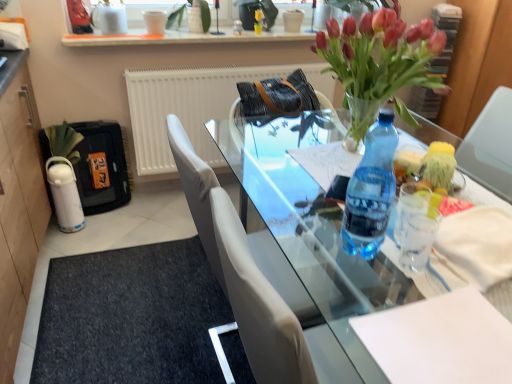
You are a GUI agent. You are given a task and a screenshot of the screen. Output one action in this format:
    pyautogui.click(x=<x>, y=<y>)
    Task: Click on the blue translucent bottle at right
    This screenshot has height=384, width=512.
    Given the screenshot: What is the action you would take?
    pyautogui.click(x=371, y=191)

Measure the distance between point (231, 118) and camera.

The depth of point (231, 118) is 6.30 feet.

At what (x,y) coordinates should I click in order to perform the action: click on black rubber doormat at lower left. Please return your answer as a coordinate pair (x, y). The image size is (512, 384). Looking at the image, I should click on (131, 317).

What is the approximate height of white plastic corded phone at upper left?

white plastic corded phone at upper left is 6.00 inches in height.

This screenshot has width=512, height=384. What do you see at coordinates (13, 36) in the screenshot? I see `white plastic corded phone at upper left` at bounding box center [13, 36].

What is the approximate height of white paper at center?

0.94 inches.

Identify the location of white paper at center. (440, 340).

Locate an element on the screen. blue translucent bottle at right is located at coordinates (371, 191).

Which is farther, (4,23) or (404,266)?

The point (4,23) is farther.

What's the angular difference between white plastic corded phone at upper left and transparent glass cup at center's facing directions?

5.73 degrees separate the facing orientations of white plastic corded phone at upper left and transparent glass cup at center.

Is the surface of white plastic corded phone at upper left in direct contact with transparent glass cup at center?

No, white plastic corded phone at upper left is not making contact with transparent glass cup at center.

Is white glossy shelf at upper center at the right side of transparent glass cup at center?

No, white glossy shelf at upper center is not to the right of transparent glass cup at center.

From the image's perspective, which is above, white glossy shelf at upper center or transparent glass cup at center?

From the image's view, white glossy shelf at upper center is above.

Locate an element on the screen. The image size is (512, 384). window sill on the left of transparent glass cup at center is located at coordinates (183, 38).

In terms of height, does transparent glass cup at center look taller or shorter compared to white plastic corded phone at upper left?

In the image, transparent glass cup at center appears to be shorter than white plastic corded phone at upper left.

From the image's perspective, is transparent glass cup at center located beneath white plastic corded phone at upper left?

Correct, transparent glass cup at center appears lower than white plastic corded phone at upper left in the image.

Is transparent glass cup at center in contact with white plastic corded phone at upper left?

transparent glass cup at center and white plastic corded phone at upper left are clearly separated.

Is transparent glass cup at center positioned with its back to white plastic corded phone at upper left?

No, transparent glass cup at center's orientation is not away from white plastic corded phone at upper left.

Does white paper at center have a smaller size compared to black rubber doormat at lower left?

Yes.

Does white paper at center come in front of black rubber doormat at lower left?

Yes, it is.

Is white paper at center oriented away from black rubber doormat at lower left?

No, white paper at center is not facing the opposite direction of black rubber doormat at lower left.

From their relative heights in the image, would you say black rubber doormat at lower left is taller or shorter than white paper at center?

black rubber doormat at lower left is taller than white paper at center.

Is black rubber doormat at lower left beside white paper at center?

They are not placed beside each other.

Between black rubber doormat at lower left and white paper at center, which one has larger size?

Bigger between the two is black rubber doormat at lower left.

In order to click on armchair to the left of white matte flowerpot at upper center in this screenshot , I will do `click(234, 126)`.

From the image's perspective, who appears lower, leather at center or white matte flowerpot at upper center?

leather at center.

Is leather at center touching white matte flowerpot at upper center?

leather at center and white matte flowerpot at upper center are not in contact.

From a real-world perspective, is leather at center on white matte flowerpot at upper center?

No, from a real-world perspective, leather at center is not above white matte flowerpot at upper center.

How much distance is there between transparent glass table at center and white matte radiator at upper center?

transparent glass table at center and white matte radiator at upper center are 36.20 inches apart.

From a real-world perspective, is transparent glass table at center positioned above or below white matte radiator at upper center?

In terms of real-world spatial position, transparent glass table at center is below white matte radiator at upper center.

Based on their positions, is transparent glass table at center located to the left or right of white matte radiator at upper center?

transparent glass table at center is positioned on white matte radiator at upper center's right side.

Which is closer, (251, 150) or (205, 149)?

Point (251, 150) is closer to the camera than point (205, 149).

You are a GUI agent. You are given a task and a screenshot of the screen. Output one action in this format:
    pyautogui.click(x=<x>, y=<y>)
    Task: Click on the corded phone above the transparent glass cup at center (from the image's perspective)
    The width and height of the screenshot is (512, 384).
    Given the screenshot: What is the action you would take?
    pyautogui.click(x=13, y=36)

Identify the location of window sill lying behind the transparent glass cup at center. (183, 38).

Which object lies further to the anchor point blue translucent bottle at right, black rubber doormat at lower left or white plastic corded phone at upper left?

white plastic corded phone at upper left lies further to blue translucent bottle at right than the other object.

Considering their positions, is white matte flowerpot at upper center positioned further to white plastic corded phone at upper left than leather at center?

Among the two, white matte flowerpot at upper center is located further to white plastic corded phone at upper left.

From the picture: Which object lies nearer to the anchor point white plastic corded phone at upper left, transparent glass table at center or white matte radiator at upper center?

white matte radiator at upper center lies closer to white plastic corded phone at upper left than the other object.

Considering their positions, is white matte flowerpot at upper center positioned closer to transparent glass cup at center than leather at center?

leather at center lies closer to transparent glass cup at center than the other object.

Based on the photo, from the image, which object appears to be farther from leather at center, white glossy shelf at upper center or blue translucent bottle at right?

Among the two, blue translucent bottle at right is located further to leather at center.

Estimate the real-world distances between objects in this image. Which object is closer to transparent glass cup at center, transparent glass table at center or black rubber doormat at lower left?

The object closer to transparent glass cup at center is transparent glass table at center.

Considering their positions, is transparent glass table at center positioned closer to transparent glass cup at center than blue translucent bottle at right?

blue translucent bottle at right lies closer to transparent glass cup at center than the other object.

Consider the image. Looking at the image, which one is located further to transparent glass cup at center, leather at center or transparent glass table at center?

Based on the image, leather at center appears to be further to transparent glass cup at center.

I want to click on bottle between white plastic corded phone at upper left and transparent glass table at center from left to right, so click(371, 191).

In order to click on doormat between white paper at center and white matte flowerpot at upper center in the front-back direction in this screenshot , I will do click(x=131, y=317).

The height and width of the screenshot is (384, 512). I want to click on window sill between leather at center and white matte flowerpot at upper center along the z-axis, so click(183, 38).

Find the location of a particular element. The image size is (512, 384). doormat located between white paper at center and white matte radiator at upper center in the depth direction is located at coordinates (131, 317).